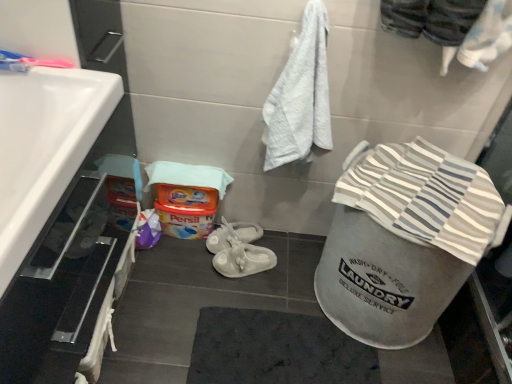
Question: Is striped cotton beach towel at lower right inside or outside of white rubber sandals at center?

Choices:
 (A) outside
 (B) inside

Answer: (A)

Question: Based on their sizes in the image, would you say striped cotton beach towel at lower right is bigger or smaller than white rubber sandals at center?

Choices:
 (A) small
 (B) big

Answer: (B)

Question: Which object is the farthest from the striped cotton beach towel at lower right?

Choices:
 (A) white rubber sandals at center
 (B) white glossy sink at left

Answer: (B)

Question: Estimate the real-world distances between objects in this image. Which object is farther from the white glossy sink at left?

Choices:
 (A) striped cotton beach towel at lower right
 (B) white rubber sandals at center

Answer: (B)